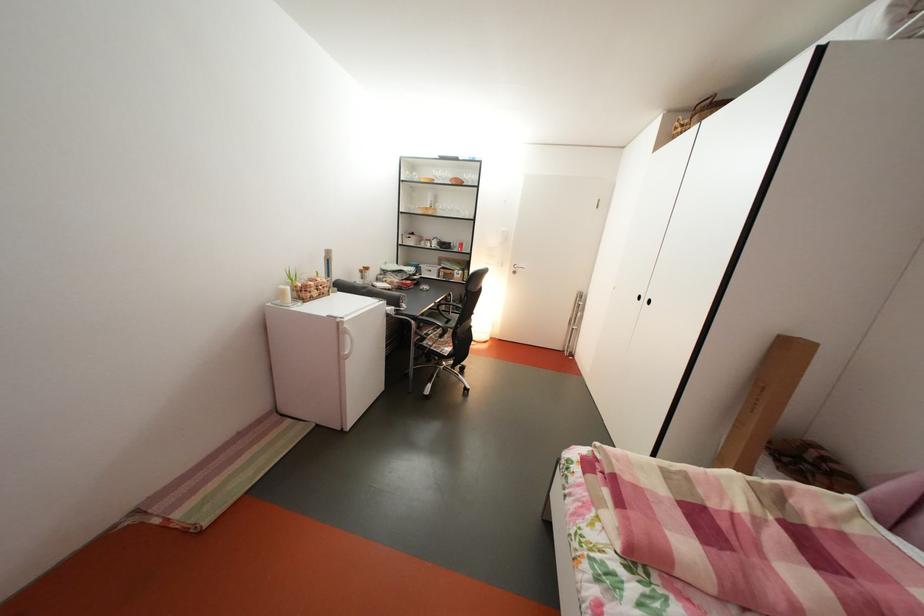
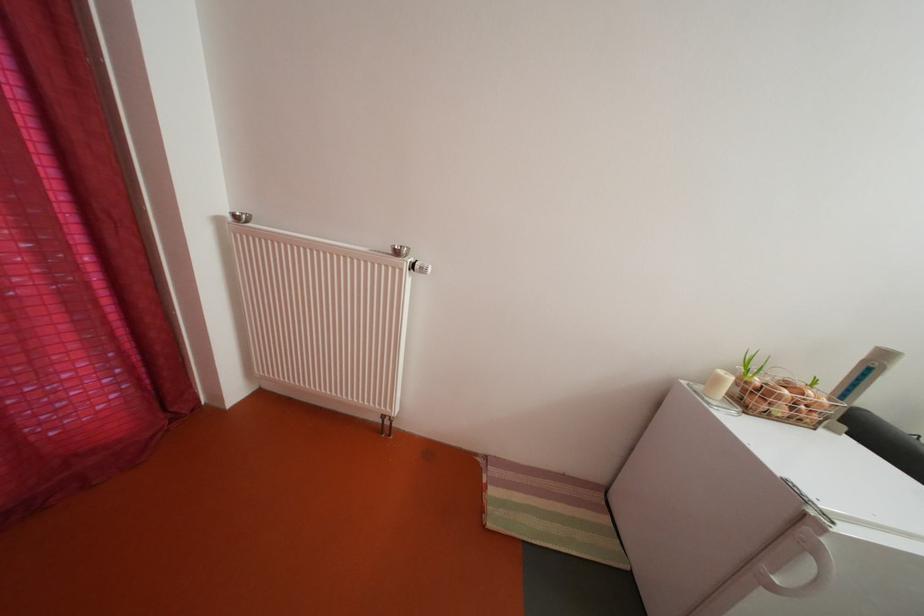
Find the pixel in the second image that matches (326,300) in the first image.

(792, 416)